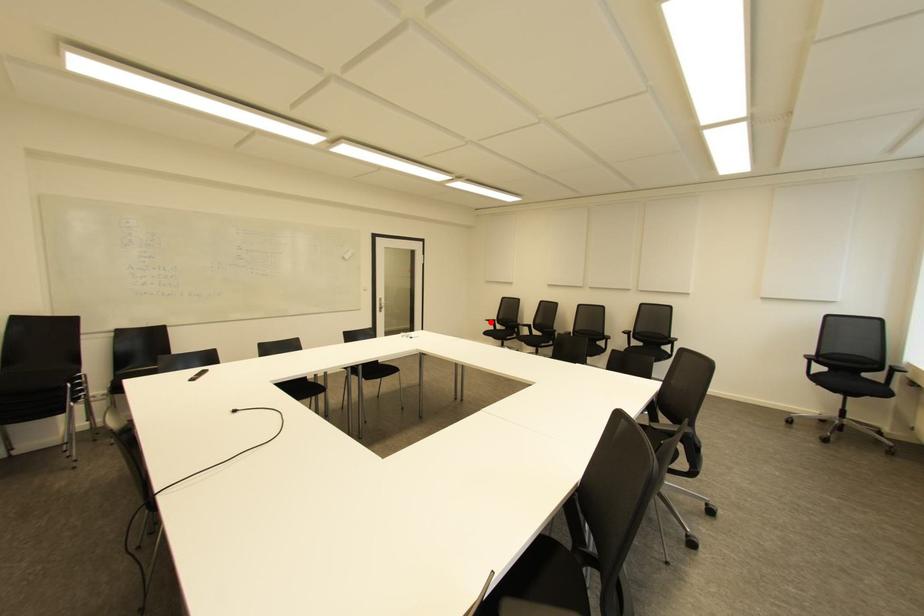
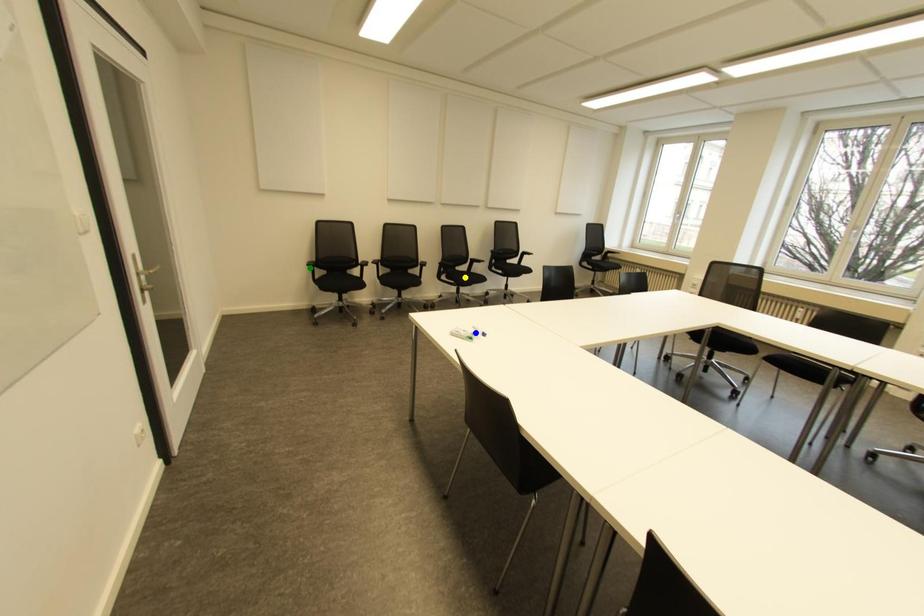
Question: I am providing you with two images of the same scene from different viewpoints. A red point is marked on the first image. You are given multiple points on the second image. Which mark in image 2 goes with the point in image 1?

Choices:
 (A) green point
 (B) blue point
 (C) yellow point

Answer: (A)